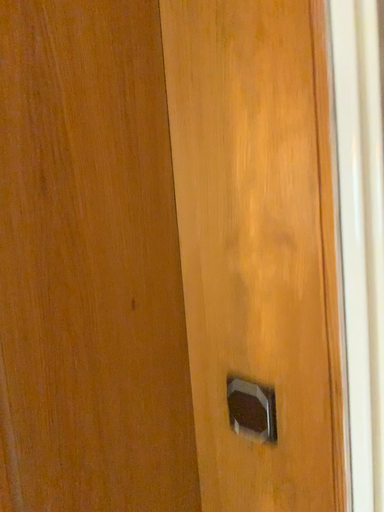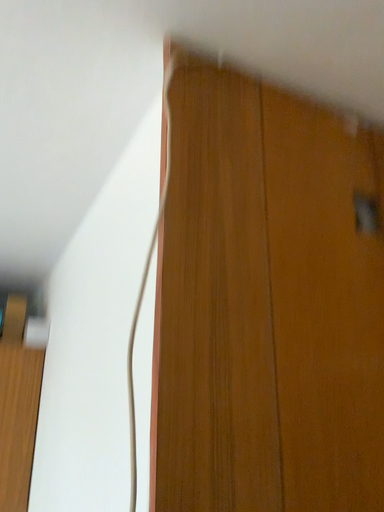
Question: How did the camera likely rotate when shooting the video?

Choices:
 (A) rotated upward
 (B) rotated downward

Answer: (A)